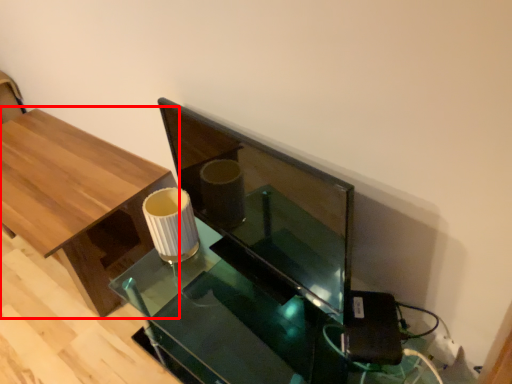
Question: From the image's perspective, considering the relative positions of table (annotated by the red box) and round table in the image provided, where is table (annotated by the red box) located with respect to the staircase?

Choices:
 (A) above
 (B) below

Answer: (A)